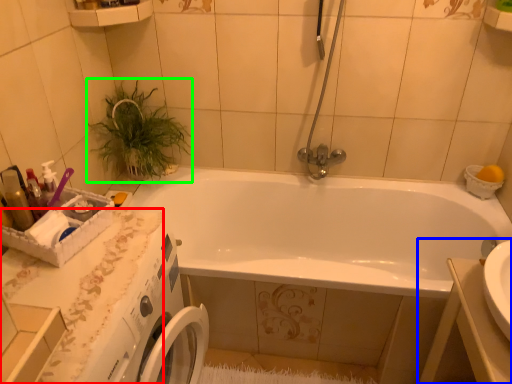
Question: Which object is positioned farthest from counter top (highlighted by a red box)? Select from sink (highlighted by a blue box) and plant (highlighted by a green box).

Choices:
 (A) sink
 (B) plant

Answer: (A)